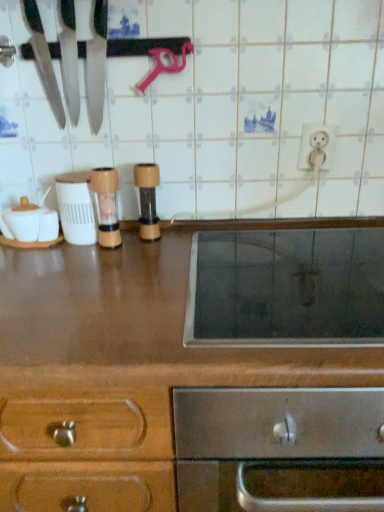
Find the location of a particular element. Image resolution: width=384 pixels, height=512 pixels. vacant area that is situated to the right of brown wood pepper grinder at center, the first appliance when ordered from right to left is located at coordinates (196, 237).